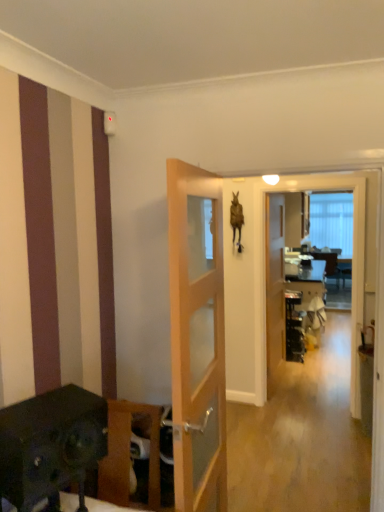
The image size is (384, 512). In order to click on free location to the right of wooden door at center, the 1th door positioned from the right in this screenshot , I will do `click(316, 382)`.